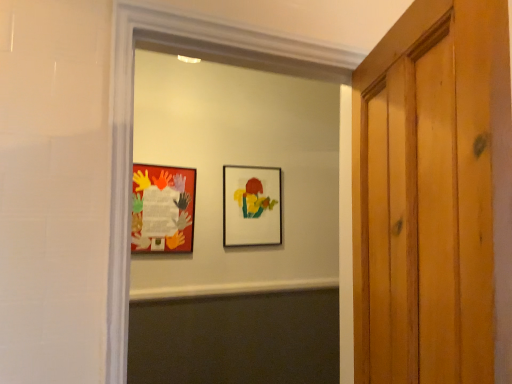
Measure the distance between matte paper collage at center and camera.

The distance of matte paper collage at center from camera is 7.74 feet.

What is the approximate width of matte paper collage at center?

10.04 inches.

This screenshot has width=512, height=384. I want to click on matte paper collage at center, so click(x=241, y=165).

Does matte plastic picture frame at center, the 1th picture frame in the back-to-front sequence, touch matte paper collage at center?

No, matte plastic picture frame at center, the 1th picture frame in the back-to-front sequence, is not next to matte paper collage at center.

Which is correct: matte plastic picture frame at center, the 1th picture frame in the back-to-front sequence, is inside matte paper collage at center, or outside of it?

matte plastic picture frame at center, the 1th picture frame in the back-to-front sequence, is outside matte paper collage at center.

Does point (277, 168) lie behind point (258, 157)?

Yes, point (277, 168) is behind point (258, 157).

The height and width of the screenshot is (384, 512). I want to click on the 1st picture frame counting from the left side of the matte paper collage at center, so [252, 206].

From the image's perspective, which is above, matte paper collage at center or matte paper collage at left, the 2th picture frame when ordered from right to left?

matte paper collage at left, the 2th picture frame when ordered from right to left.

In terms of size, does matte paper collage at center appear bigger or smaller than matte paper collage at left, which is counted as the first picture frame, starting from the left?

Clearly, matte paper collage at center is larger in size than matte paper collage at left, which is counted as the first picture frame, starting from the left.

Does matte paper collage at center touch matte plastic picture frame at center, which is the first picture frame in right-to-left order?

No, matte paper collage at center is not making contact with matte plastic picture frame at center, which is the first picture frame in right-to-left order.

Consider the image. Would you say matte paper collage at center is inside or outside matte plastic picture frame at center, which is counted as the second picture frame, starting from the front?

matte paper collage at center is not inside matte plastic picture frame at center, which is counted as the second picture frame, starting from the front, it's outside.

How many degrees apart are the facing directions of matte paper collage at center and matte plastic picture frame at center, the 1th picture frame in the back-to-front sequence?

0.671 degrees separate the facing orientations of matte paper collage at center and matte plastic picture frame at center, the 1th picture frame in the back-to-front sequence.

From a real-world perspective, is matte paper collage at center below matte plastic picture frame at center, which is counted as the second picture frame, starting from the front?

Correct, in the physical world, matte paper collage at center is lower than matte plastic picture frame at center, which is counted as the second picture frame, starting from the front.

Does matte paper collage at left, which appears as the 1th picture frame when viewed from the front, have a larger size compared to matte paper collage at center?

No, matte paper collage at left, which appears as the 1th picture frame when viewed from the front, is not bigger than matte paper collage at center.

Considering the relative positions of matte paper collage at left, which appears as the 1th picture frame when viewed from the front, and matte paper collage at center in the image provided, is matte paper collage at left, which appears as the 1th picture frame when viewed from the front, to the right of matte paper collage at center from the viewer's perspective?

Incorrect, matte paper collage at left, which appears as the 1th picture frame when viewed from the front, is not on the right side of matte paper collage at center.

In the scene shown: Does matte paper collage at left, which appears as the 1th picture frame when viewed from the front, have a smaller size compared to matte plastic picture frame at center, marked as the 2th picture frame in a left-to-right arrangement?

Yes.

Is matte paper collage at left, which appears as the 1th picture frame when viewed from the front, in front of or behind matte plastic picture frame at center, marked as the 2th picture frame in a left-to-right arrangement, in the image?

matte paper collage at left, which appears as the 1th picture frame when viewed from the front, is positioned closer to the viewer than matte plastic picture frame at center, marked as the 2th picture frame in a left-to-right arrangement.

Considering the relative positions of matte paper collage at left, which appears as the 1th picture frame when viewed from the front, and matte plastic picture frame at center, which is the first picture frame in right-to-left order, in the image provided, is matte paper collage at left, which appears as the 1th picture frame when viewed from the front, to the left or to the right of matte plastic picture frame at center, which is the first picture frame in right-to-left order,?

Clearly, matte paper collage at left, which appears as the 1th picture frame when viewed from the front, is on the left of matte plastic picture frame at center, which is the first picture frame in right-to-left order, in the image.

Is matte paper collage at left, the 2th picture frame when ordered from right to left, not inside matte plastic picture frame at center, which is counted as the second picture frame, starting from the front?

matte paper collage at left, the 2th picture frame when ordered from right to left, is positioned outside matte plastic picture frame at center, which is counted as the second picture frame, starting from the front.

Which is more distant, (224,215) or (138,210)?

Point (224,215)

Locate an element on the screen. This screenshot has width=512, height=384. picture frame that appears below the matte plastic picture frame at center, marked as the 2th picture frame in a left-to-right arrangement (from a real-world perspective) is located at coordinates (163, 208).

Which of these two, matte plastic picture frame at center, which is the first picture frame in right-to-left order, or matte paper collage at left, marked as the second picture frame in a back-to-front arrangement, is wider?

Wider between the two is matte plastic picture frame at center, which is the first picture frame in right-to-left order.

Identify the location of mirror in front of the matte plastic picture frame at center, which is the first picture frame in right-to-left order. (241, 165).

Locate an element on the screen. The height and width of the screenshot is (384, 512). mirror below the matte paper collage at left, marked as the second picture frame in a back-to-front arrangement (from a real-world perspective) is located at coordinates (241, 165).

From the image, which object appears to be nearer to matte paper collage at center, matte plastic picture frame at center, which is counted as the second picture frame, starting from the front, or matte paper collage at left, which is counted as the first picture frame, starting from the left?

Based on the image, matte plastic picture frame at center, which is counted as the second picture frame, starting from the front, appears to be nearer to matte paper collage at center.

When comparing their distances from matte paper collage at left, which is counted as the first picture frame, starting from the left, does matte paper collage at center or matte plastic picture frame at center, marked as the 2th picture frame in a left-to-right arrangement, seem closer?

The object closer to matte paper collage at left, which is counted as the first picture frame, starting from the left, is matte paper collage at center.

Considering their positions, is matte paper collage at left, which is counted as the first picture frame, starting from the left, positioned closer to matte paper collage at center than matte plastic picture frame at center, the 1th picture frame in the back-to-front sequence?

matte plastic picture frame at center, the 1th picture frame in the back-to-front sequence, is positioned closer to the anchor matte paper collage at center.

Looking at the image, which one is located further to matte plastic picture frame at center, marked as the 2th picture frame in a left-to-right arrangement, matte paper collage at center or matte paper collage at left, which is counted as the first picture frame, starting from the left?

The object further to matte plastic picture frame at center, marked as the 2th picture frame in a left-to-right arrangement, is matte paper collage at left, which is counted as the first picture frame, starting from the left.

Based on their spatial positions, is matte paper collage at left, which appears as the 1th picture frame when viewed from the front, or matte paper collage at center further from matte plastic picture frame at center, which is the first picture frame in right-to-left order?

matte paper collage at left, which appears as the 1th picture frame when viewed from the front, is positioned further to the anchor matte plastic picture frame at center, which is the first picture frame in right-to-left order.

Considering their positions, is matte plastic picture frame at center, marked as the 2th picture frame in a left-to-right arrangement, positioned further to matte paper collage at left, marked as the second picture frame in a back-to-front arrangement, than matte paper collage at center?

matte plastic picture frame at center, marked as the 2th picture frame in a left-to-right arrangement, is positioned further to the anchor matte paper collage at left, marked as the second picture frame in a back-to-front arrangement.

Image resolution: width=512 pixels, height=384 pixels. Find the location of `picture frame located between matte paper collage at center and matte plastic picture frame at center, which is the first picture frame in right-to-left order, in the depth direction`. picture frame located between matte paper collage at center and matte plastic picture frame at center, which is the first picture frame in right-to-left order, in the depth direction is located at coordinates (163, 208).